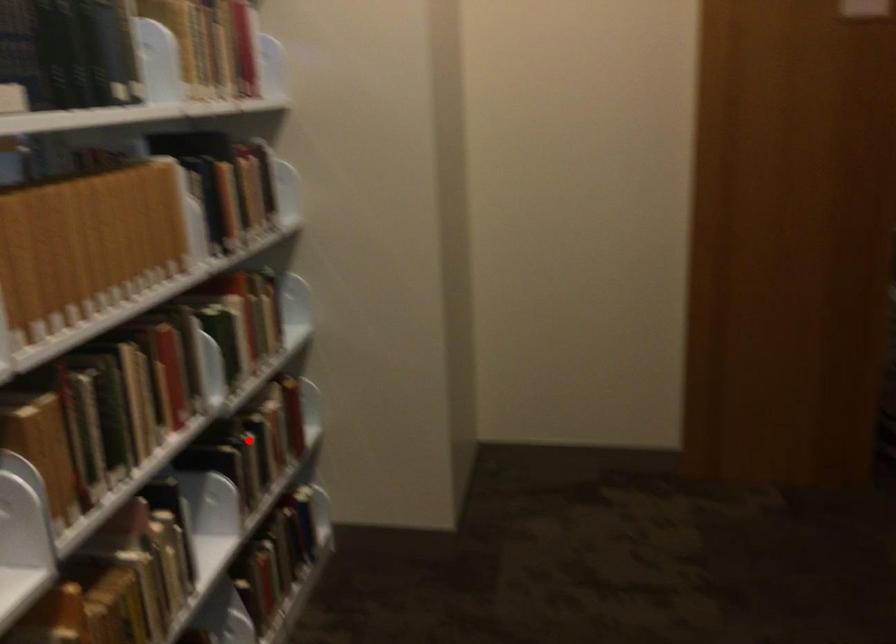
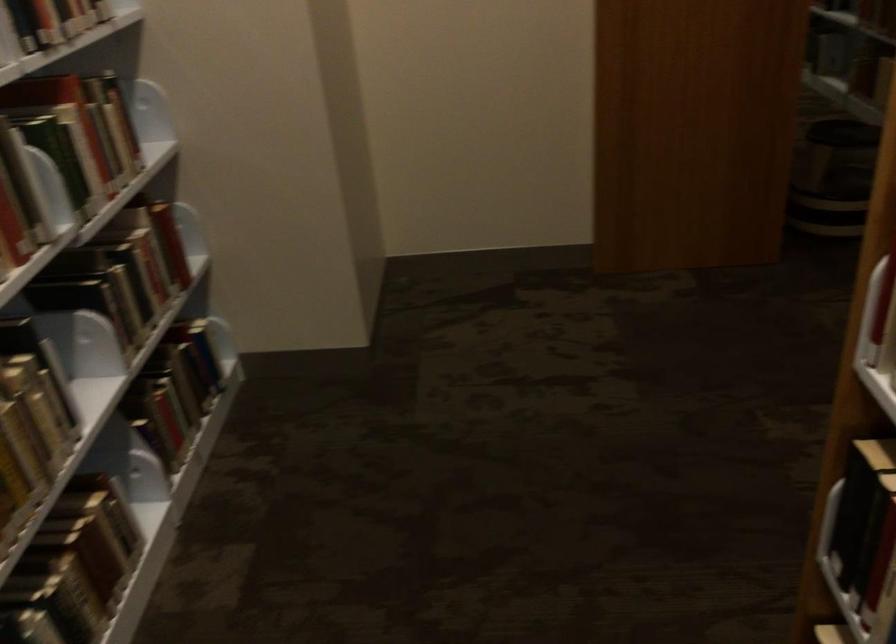
Question: I am providing you with two images of the same scene from different viewpoints. In image1, a red point is highlighted. Considering the same 3D point in image2, which of the following is correct?

Choices:
 (A) It is closer
 (B) It is farther

Answer: (A)